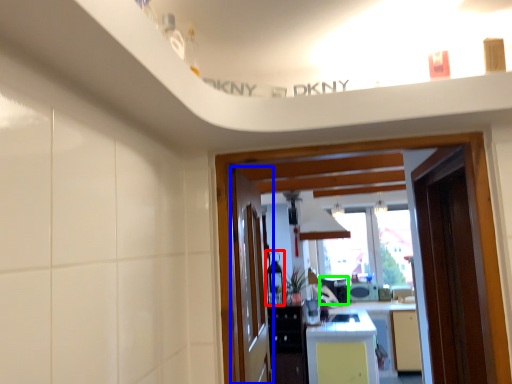
Question: Estimate the real-world distances between objects in this image. Which object is farther from appliance (highlighted by a red box), door (highlighted by a blue box) or appliance (highlighted by a green box)?

Choices:
 (A) door
 (B) appliance

Answer: (A)